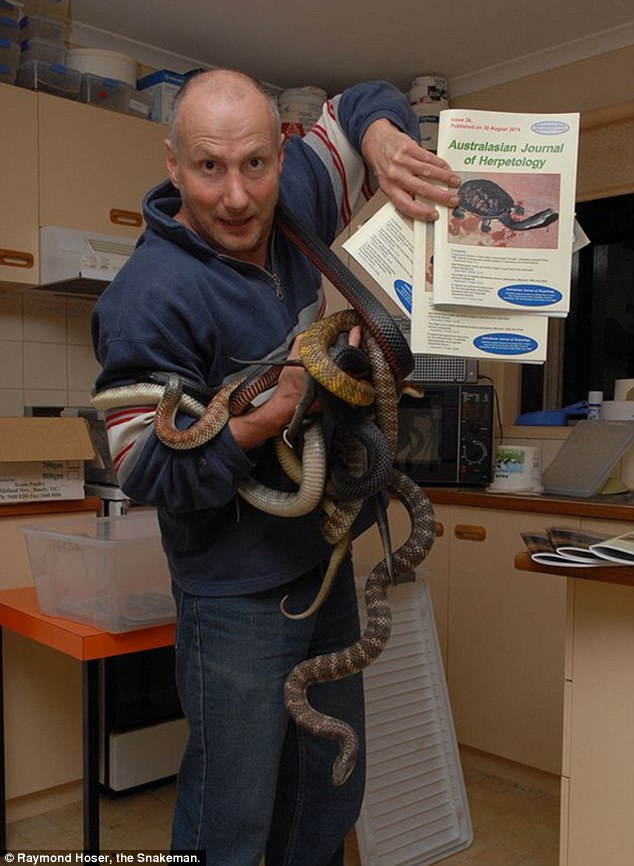
Identify the location of window. Image resolution: width=634 pixels, height=866 pixels. (597, 326), (534, 386).